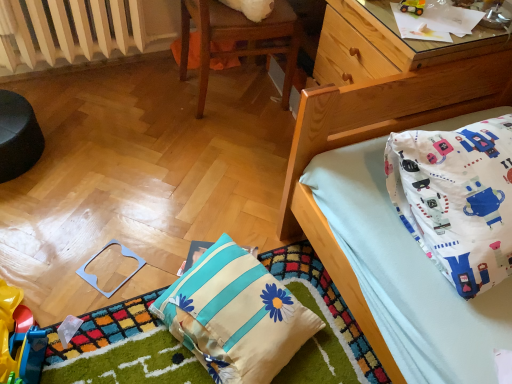
Question: Can you confirm if rubberized plastic toy at lower left, which ranks as the 1th toy in bottom-to-top order, is shorter than light blue plastic square at lower left, which is counted as the second toy, starting from the top?

Choices:
 (A) no
 (B) yes

Answer: (A)

Question: Considering the relative sizes of rubberized plastic toy at lower left, the 1th toy positioned from the left, and light blue plastic square at lower left, which is the 2th toy from bottom to top, in the image provided, is rubberized plastic toy at lower left, the 1th toy positioned from the left, bigger than light blue plastic square at lower left, which is the 2th toy from bottom to top,?

Choices:
 (A) yes
 (B) no

Answer: (A)

Question: From a real-world perspective, is rubberized plastic toy at lower left, the 1th toy positioned from the left, positioned over light blue plastic square at lower left, which is counted as the second toy, starting from the top, based on gravity?

Choices:
 (A) yes
 (B) no

Answer: (A)

Question: Is rubberized plastic toy at lower left, which ranks as the 3th toy in right-to-left order, far away from light blue plastic square at lower left, which is counted as the second toy, starting from the top?

Choices:
 (A) no
 (B) yes

Answer: (A)

Question: Is rubberized plastic toy at lower left, the 1th toy positioned from the left, taller than light blue plastic square at lower left, which is the second toy in right-to-left order?

Choices:
 (A) no
 (B) yes

Answer: (B)

Question: Is point (351, 9) closer or farther from the camera than point (117, 43)?

Choices:
 (A) farther
 (B) closer

Answer: (B)

Question: From the image's perspective, is wooden bed at upper right located above or below white painted metal radiator at upper left?

Choices:
 (A) above
 (B) below

Answer: (B)

Question: In terms of height, does wooden bed at upper right look taller or shorter compared to white painted metal radiator at upper left?

Choices:
 (A) short
 (B) tall

Answer: (B)

Question: Considering the positions of wooden bed at upper right and white painted metal radiator at upper left in the image, is wooden bed at upper right wider or thinner than white painted metal radiator at upper left?

Choices:
 (A) thin
 (B) wide

Answer: (B)

Question: Relative to metallic yellow toy car at upper right, placed as the 1th toy when sorted from top to bottom, is wooden bed at upper right in front or behind?

Choices:
 (A) behind
 (B) front

Answer: (B)

Question: From the image's perspective, is wooden bed at upper right located above or below metallic yellow toy car at upper right, arranged as the third toy when ordered from the bottom?

Choices:
 (A) above
 (B) below

Answer: (A)

Question: In terms of width, does wooden bed at upper right look wider or thinner when compared to metallic yellow toy car at upper right, arranged as the third toy when ordered from the bottom?

Choices:
 (A) thin
 (B) wide

Answer: (B)

Question: Is point (326, 99) closer or farther from the camera than point (415, 1)?

Choices:
 (A) farther
 (B) closer

Answer: (B)

Question: From the image's perspective, is metallic yellow toy car at upper right, the 1th toy viewed from the right, above or below white fabric pillow at upper right, the 1th pillow positioned from the right?

Choices:
 (A) above
 (B) below

Answer: (A)

Question: Visually, is metallic yellow toy car at upper right, the 1th toy viewed from the right, positioned to the left or to the right of white fabric pillow at upper right, the 1th pillow positioned from the right?

Choices:
 (A) left
 (B) right

Answer: (A)